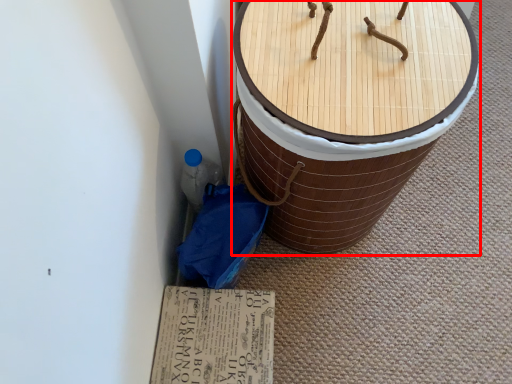
Question: From the image's perspective, what is the correct spatial positioning of furniture (annotated by the red box) in reference to cardboard?

Choices:
 (A) above
 (B) below

Answer: (A)